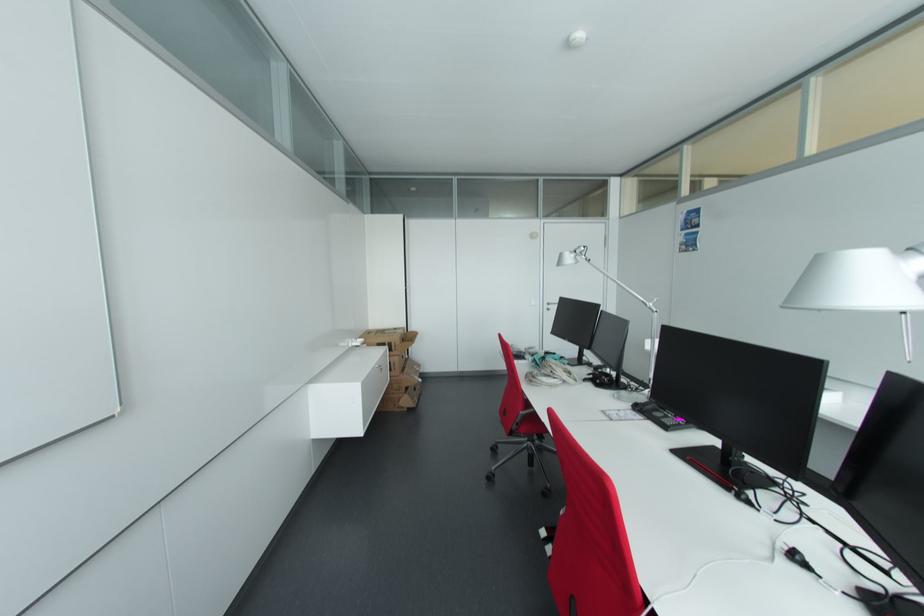
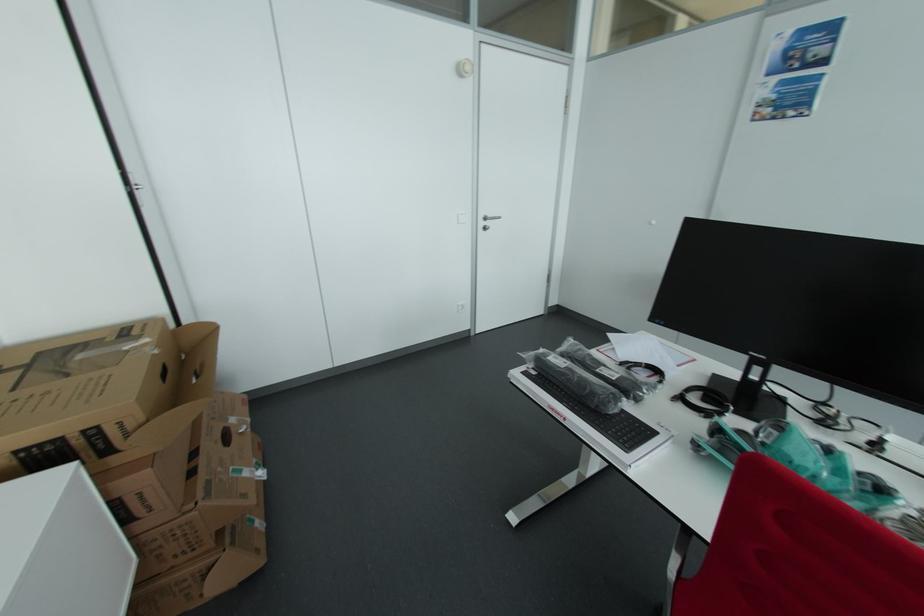
Find the pixel in the second image that matches pixel 420 371 in the first image.

(245, 432)